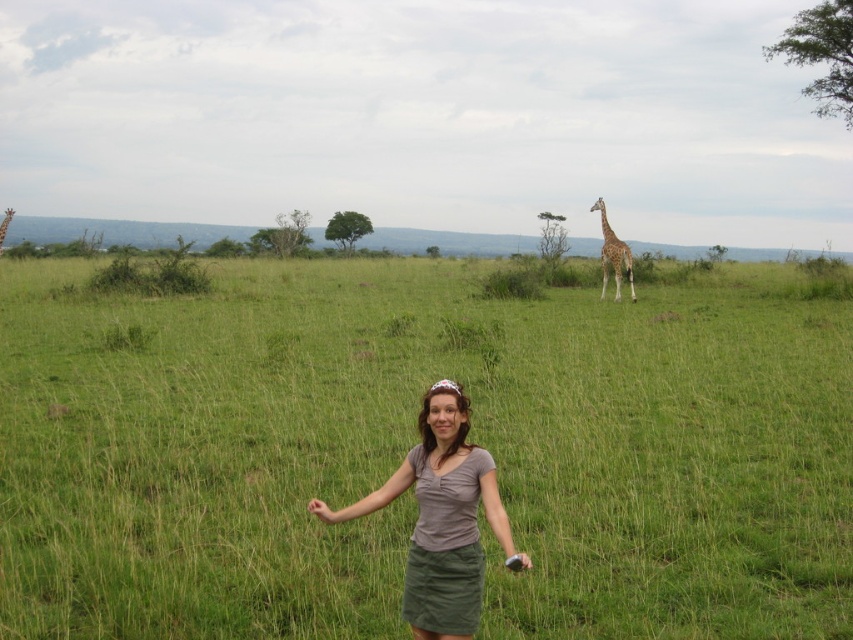
Question: Does green grassy field at center have a lesser width compared to spotted fur giraffe at right?

Choices:
 (A) no
 (B) yes

Answer: (A)

Question: Does green grassy field at center have a larger size compared to spotted fur giraffe at right?

Choices:
 (A) no
 (B) yes

Answer: (B)

Question: Which point appears closest to the camera in this image?

Choices:
 (A) tap(604, 214)
 (B) tap(457, 528)
 (C) tap(1, 246)
 (D) tap(24, 564)

Answer: (B)

Question: Based on their relative distances, which object is farther from the brown textured giraffe at upper right?

Choices:
 (A) spotted fur giraffe at right
 (B) matte gray shirt at center
 (C) green grassy field at center

Answer: (B)

Question: Can you confirm if green grassy field at center is positioned to the right of matte gray shirt at center?

Choices:
 (A) no
 (B) yes

Answer: (A)

Question: Which object appears farthest from the camera in this image?

Choices:
 (A) brown textured giraffe at upper right
 (B) matte gray shirt at center
 (C) green grassy field at center
 (D) spotted fur giraffe at right

Answer: (A)